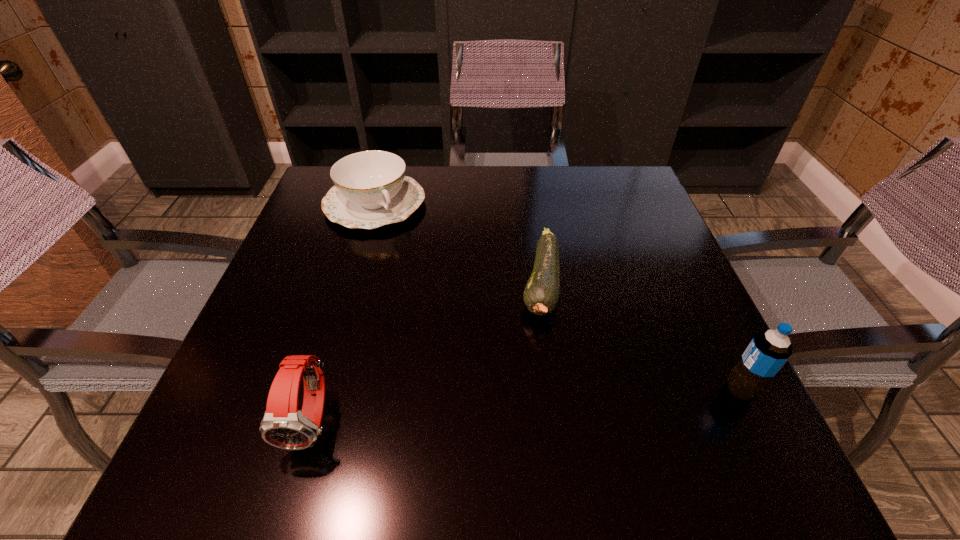
Find the location of a particular element. free space located on the handle side of the chinaware is located at coordinates (455, 311).

Where is `vacant space located 0.230m on the handle side of the chinaware`? Image resolution: width=960 pixels, height=540 pixels. vacant space located 0.230m on the handle side of the chinaware is located at coordinates (438, 287).

Locate an element on the screen. This screenshot has width=960, height=540. free space located 0.060m on the handle side of the chinaware is located at coordinates (405, 244).

Find the location of a particular element. object present at the far edge is located at coordinates (371, 190).

Where is `watch present at the near edge`? watch present at the near edge is located at coordinates (283, 426).

Where is `soda bottle situated at the near edge`? soda bottle situated at the near edge is located at coordinates (768, 351).

The width and height of the screenshot is (960, 540). Find the location of `watch located at the left edge`. watch located at the left edge is located at coordinates (283, 426).

This screenshot has width=960, height=540. In order to click on chinaware that is at the left edge in this screenshot , I will do `click(371, 190)`.

Identify the location of object that is at the right edge. This screenshot has width=960, height=540. (768, 351).

This screenshot has height=540, width=960. Identify the location of object present at the far left corner. (371, 190).